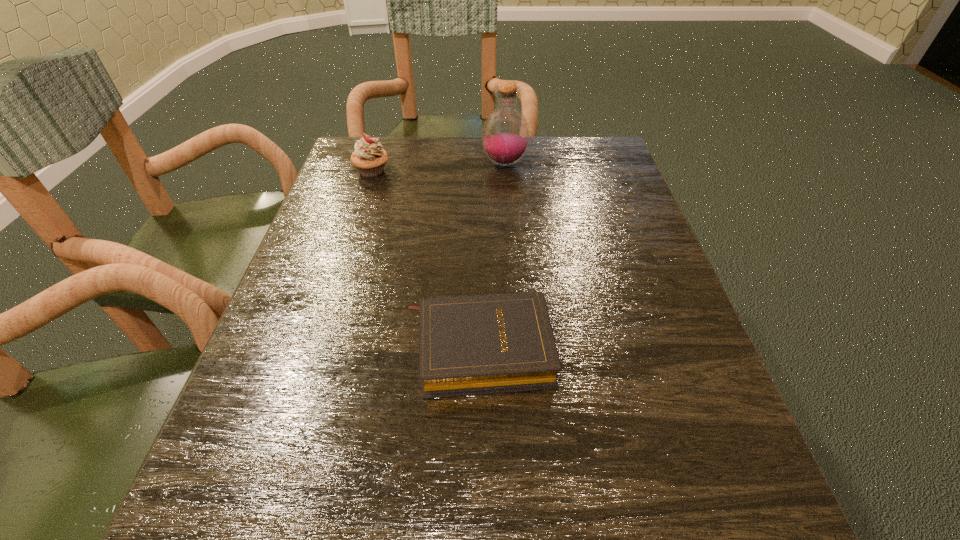
The width and height of the screenshot is (960, 540). Identify the location of empty location between the cupcake and the bottle. (439, 167).

Locate an element on the screen. Image resolution: width=960 pixels, height=540 pixels. vacant region between the Bible and the cupcake is located at coordinates (425, 260).

Where is `free space between the shortest object and the leftmost object`? free space between the shortest object and the leftmost object is located at coordinates (425, 260).

The width and height of the screenshot is (960, 540). I want to click on free spot between the cupcake and the Bible, so click(x=425, y=260).

Locate an element on the screen. The width and height of the screenshot is (960, 540). vacant space in between the bottle and the second tallest object is located at coordinates (439, 167).

At what (x,y) coordinates should I click in order to perform the action: click on unoccupied position between the tallest object and the second tallest object. Please return your answer as a coordinate pair (x, y). This screenshot has width=960, height=540. Looking at the image, I should click on (439, 167).

What are the coordinates of `vacant area that lies between the bottle and the nearest object` in the screenshot? It's located at (492, 256).

Locate which object ranks in proximity to the nearest object. Please provide its 2D coordinates. Your answer should be formatted as a tuple, i.e. [(x, y)], where the tuple contains the x and y coordinates of a point satisfying the conditions above.

[(369, 158)]

Locate which object ranks in proximity to the tallest object. Please provide its 2D coordinates. Your answer should be formatted as a tuple, i.e. [(x, y)], where the tuple contains the x and y coordinates of a point satisfying the conditions above.

[(369, 158)]

At what (x,y) coordinates should I click in order to perform the action: click on free space that satisfies the following two spatial constraints: 1. on the back side of the bottle; 2. on the left side of the shortest object. Please return your answer as a coordinate pair (x, y). The image size is (960, 540). Looking at the image, I should click on (479, 164).